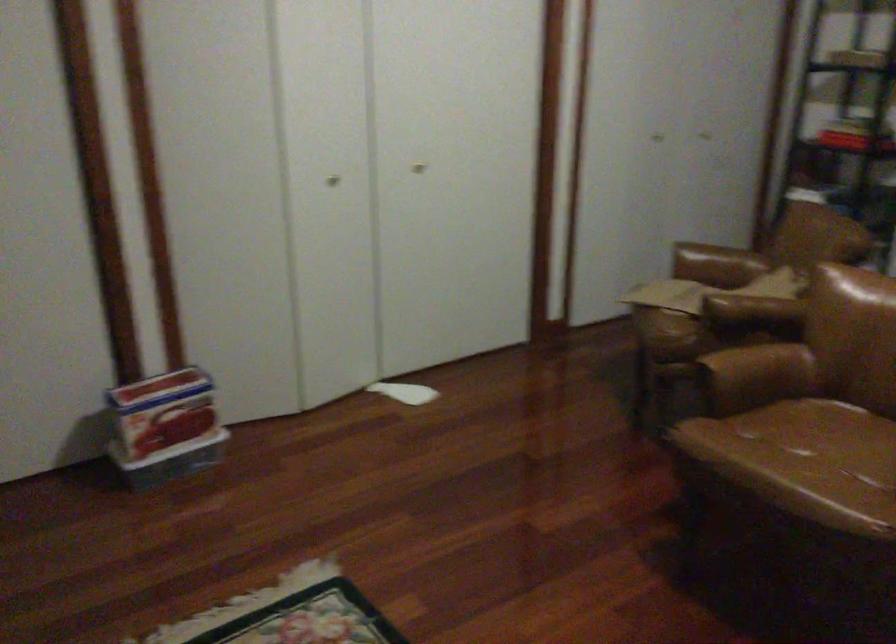
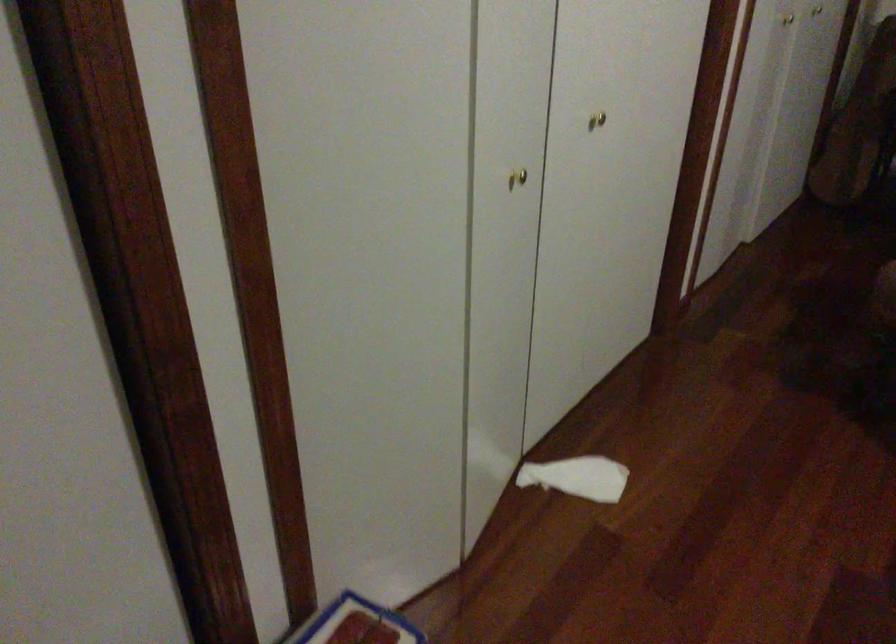
Find the pixel in the second image that matches point (410, 395) in the first image.

(578, 477)